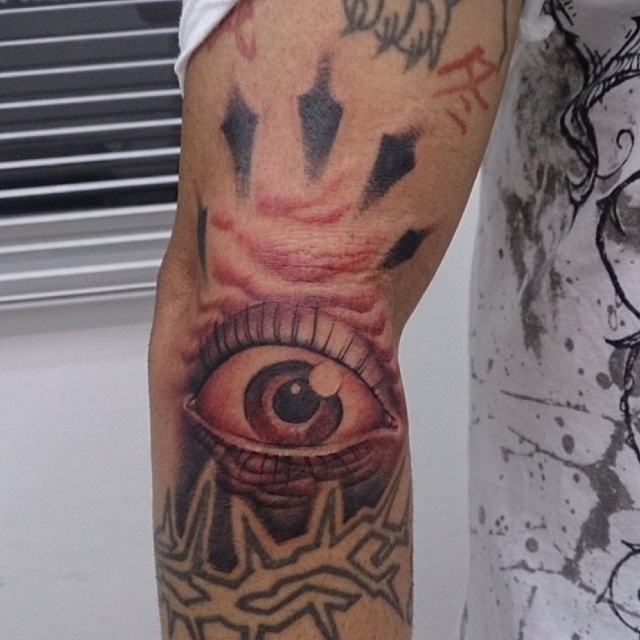
Is black tattooed eye at center closer to the viewer compared to brown glossy eye at center?

Yes, black tattooed eye at center is in front of brown glossy eye at center.

Is black tattooed eye at center to the right of brown glossy eye at center from the viewer's perspective?

No, black tattooed eye at center is not to the right of brown glossy eye at center.

Is point (225, 365) closer to camera compared to point (396, 454)?

Yes, point (225, 365) is closer to viewer.

This screenshot has width=640, height=640. In order to click on black tattooed eye at center in this screenshot , I will do [307, 305].